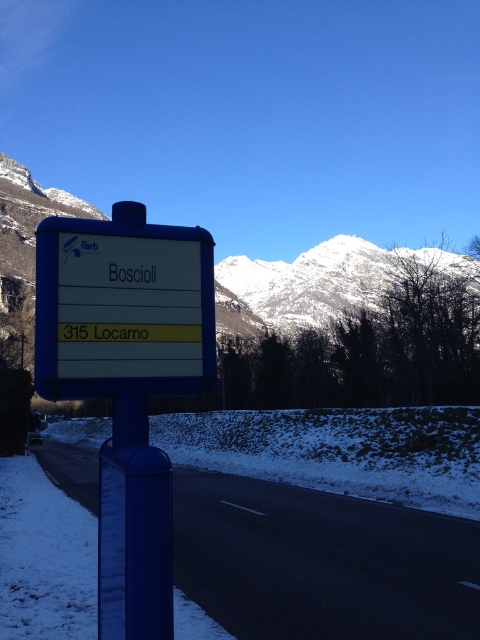
Which of these two, blue metallic sign at center or white snow-covered mountain at upper center, stands taller?

white snow-covered mountain at upper center

Does blue metallic sign at center have a smaller size compared to white snow-covered mountain at upper center?

Indeed, blue metallic sign at center has a smaller size compared to white snow-covered mountain at upper center.

Is point (66, 244) farther from viewer compared to point (383, 269)?

That is False.

At what (x,y) coordinates should I click in order to perform the action: click on blue metallic sign at center. Please return your answer as a coordinate pair (x, y). The width and height of the screenshot is (480, 640). Looking at the image, I should click on (127, 381).

Which of these two, blue plastic sign at center or white snow-covered mountain at upper center, stands taller?

Standing taller between the two is white snow-covered mountain at upper center.

Describe the element at coordinates (122, 307) in the screenshot. I see `blue plastic sign at center` at that location.

Which is in front, point (192, 352) or point (404, 262)?

Point (192, 352) is more forward.

Where is `blue plastic sign at center`? blue plastic sign at center is located at coordinates (122, 307).

Measure the distance between blue metallic sign at center and blue plastic sign at center.

blue metallic sign at center and blue plastic sign at center are 3.84 feet apart.

Does point (98, 520) come farther from viewer compared to point (123, 344)?

Yes, point (98, 520) is farther from viewer.

I want to click on blue metallic sign at center, so click(127, 381).